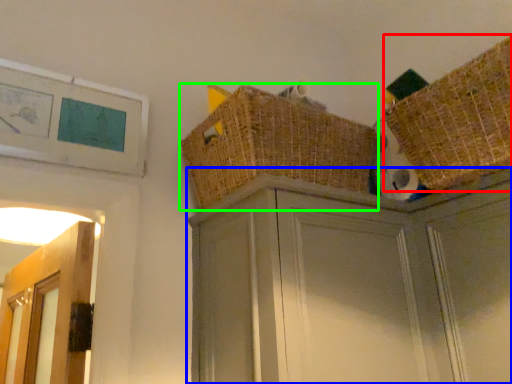
Question: Which object is the closest to the basket (highlighted by a red box)? Choose among these: cabinetry (highlighted by a blue box) or basket (highlighted by a green box).

Choices:
 (A) cabinetry
 (B) basket

Answer: (A)